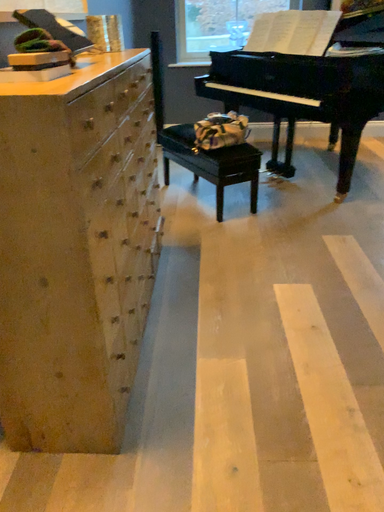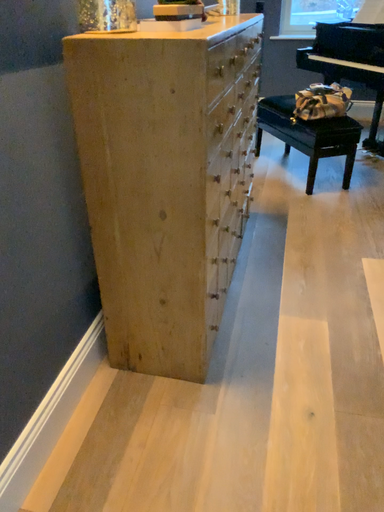
Question: Which way did the camera rotate in the video?

Choices:
 (A) rotated left
 (B) rotated right

Answer: (A)